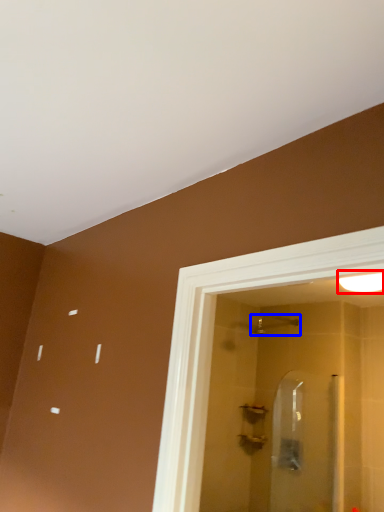
Question: Which object appears closest to the camera in this image, light fixture (highlighted by a red box) or shower (highlighted by a blue box)?

Choices:
 (A) light fixture
 (B) shower

Answer: (A)